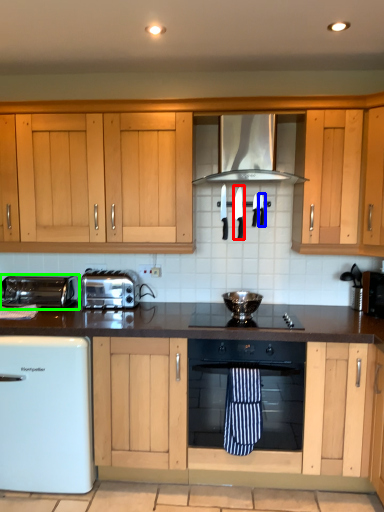
Question: Which is farther away from appliance (highlighted by a red box)? appliance (highlighted by a blue box) or kitchen appliance (highlighted by a green box)?

Choices:
 (A) appliance
 (B) kitchen appliance

Answer: (B)